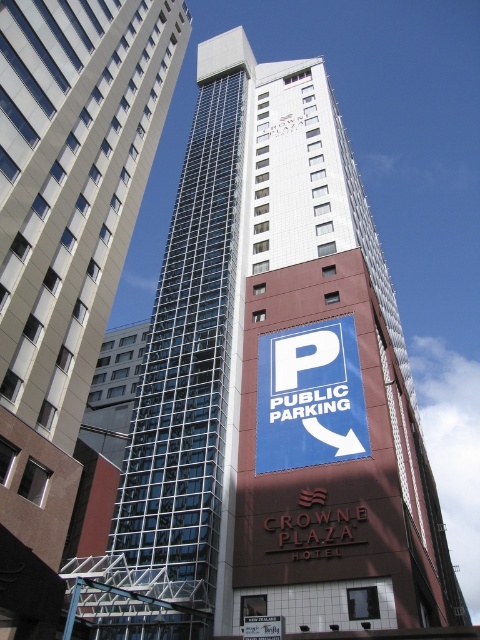
You are standing at the point with coordinates point (294, 330) in the urban scene. You want to walk to the point (129, 24). Will the building on the right block your direct path?

Point (129, 24) is behind point (294, 330), so the building on the right will block your direct path to point (129, 24).

You are a city planner reviewing the urban layout. You notice the glassy steel skyscraper at center and the blue paper sign at center. Which object is positioned higher in the image?

The glassy steel skyscraper at center is located above the blue paper sign at center, so it is positioned higher in the image.

You are a city planner assessing the space between two landmarks in the image. The glassy steel skyscraper at center and the blue paper sign at center are both important. Can a standard delivery truck that is 60 feet long navigate the space between them without any issues?

The distance between the glassy steel skyscraper at center and the blue paper sign at center is 66.29 feet, which is wider than the truck length of 60 feet. Therefore, the truck can navigate the space between them without any issues.